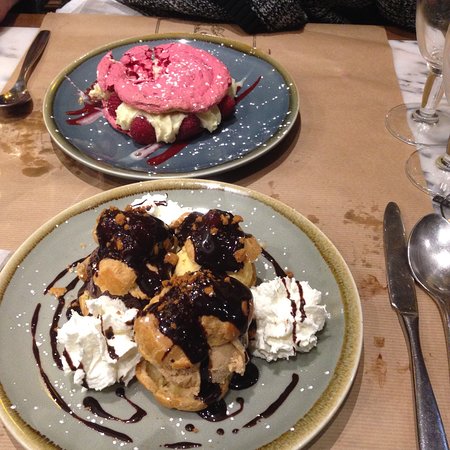
Where is `spoon`? spoon is located at coordinates (427, 246).